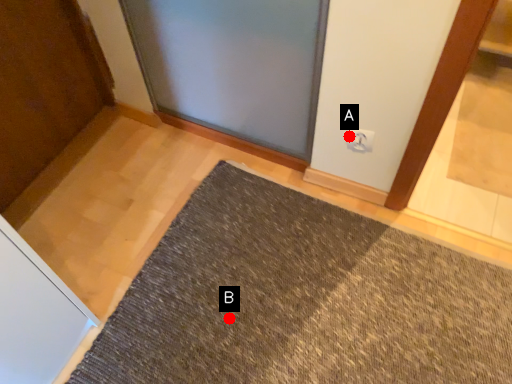
Question: Two points are circled on the image, labeled by A and B beside each circle. Which point appears closest to the camera in this image?

Choices:
 (A) A is closer
 (B) B is closer

Answer: (B)